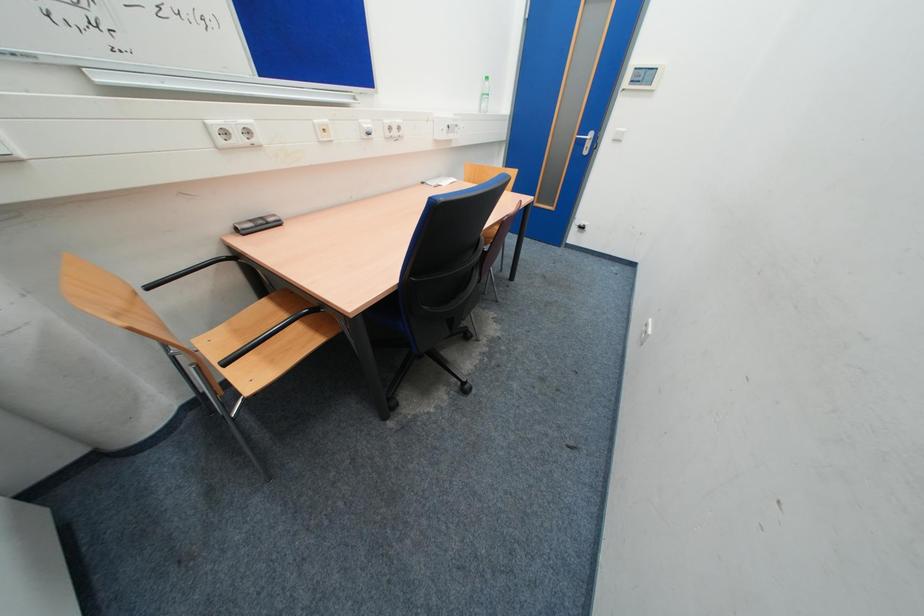
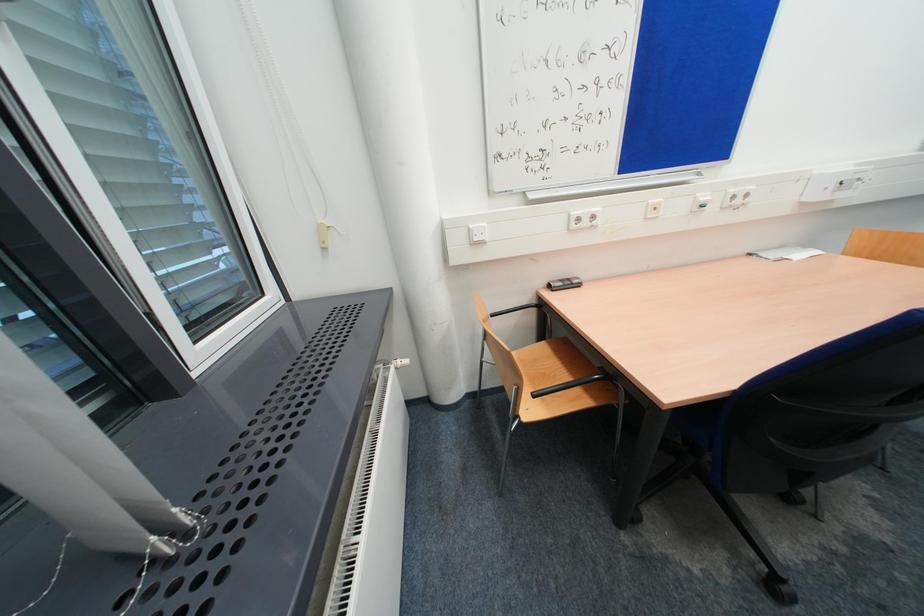
Question: The camera is either moving clockwise (left) or counter-clockwise (right) around the object. The first image is from the beginning of the video and the second image is from the end. Is the camera moving left or right when shooting the video?

Choices:
 (A) Left
 (B) Right

Answer: (B)